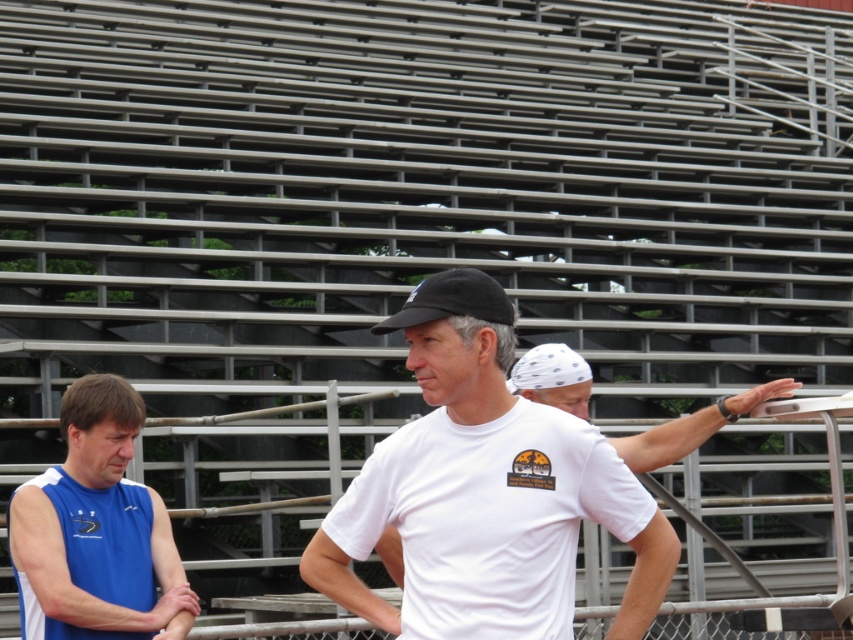
You are a photographer trying to capture a wide shot of the scene. The blue sleeveless shirt at left and the black matte baseball cap at center are in your frame. Considering their widths, which object should you prioritize keeping centered to avoid cropping either one?

The blue sleeveless shirt at left is wider than the black matte baseball cap at center. To avoid cropping either, prioritize centering the wider blue sleeveless shirt at left since it requires more space in the frame.